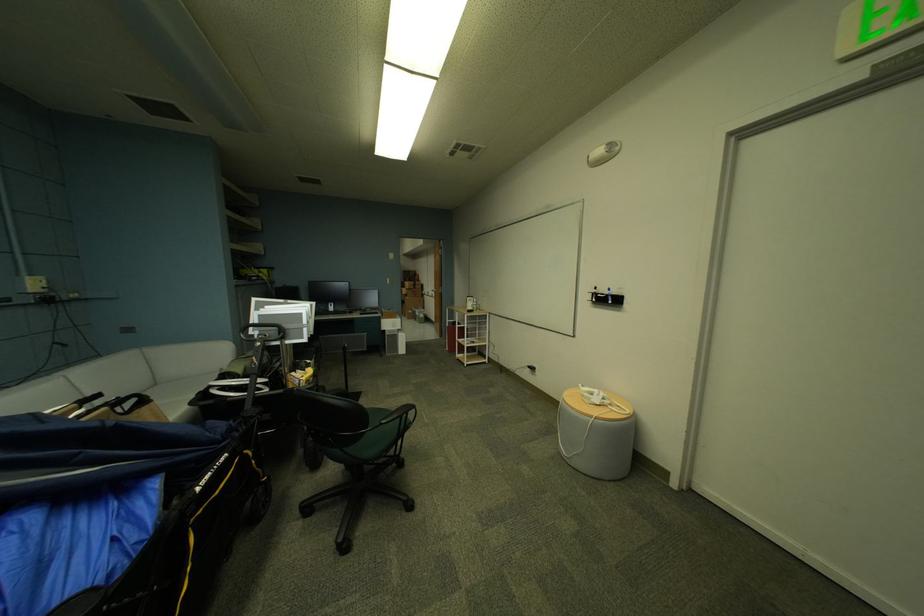
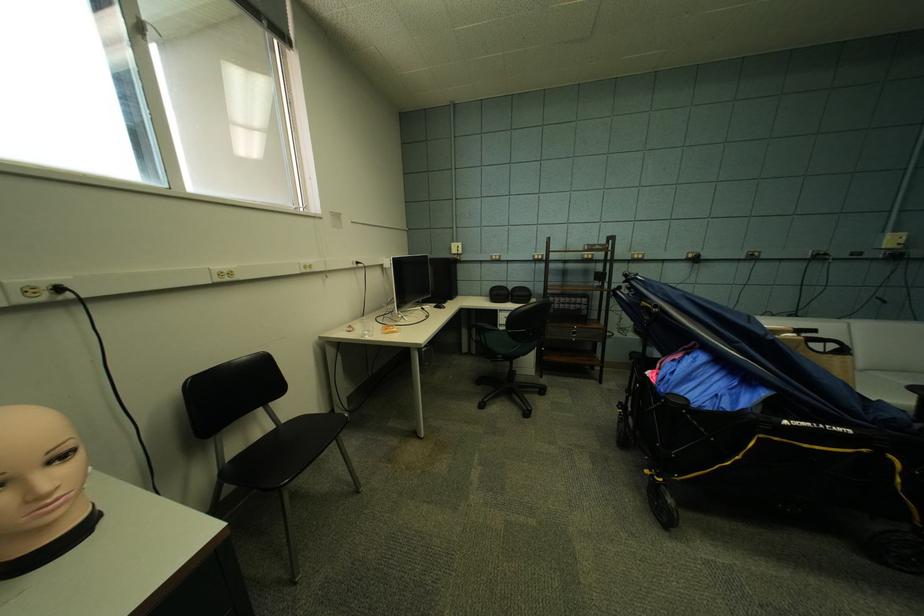
The point at (161, 405) is marked in the first image. Where is the corresponding point in the second image?

(857, 358)